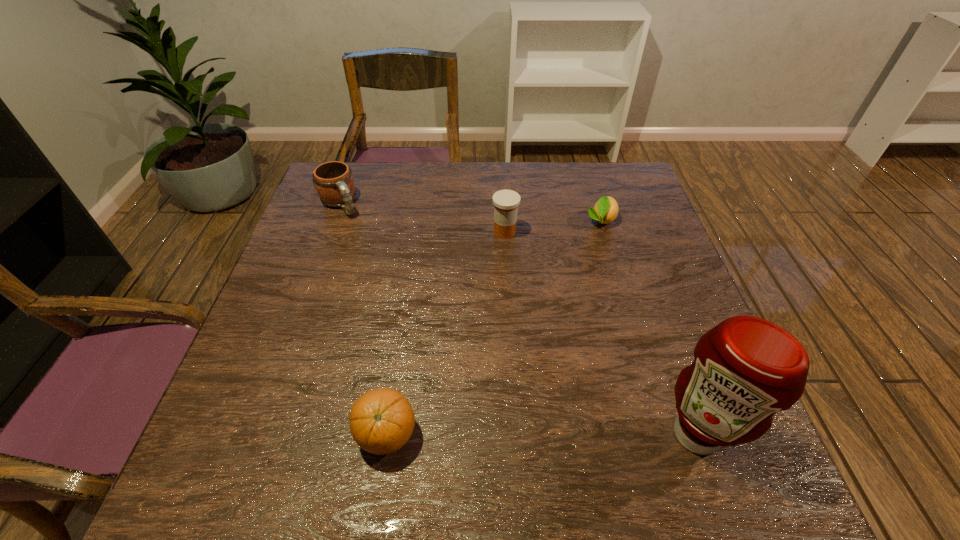
The height and width of the screenshot is (540, 960). Find the location of `vacant space on the desktop that is between the fourth object from right to left and the condiment and is positioned on the label of the third object from right to left`. vacant space on the desktop that is between the fourth object from right to left and the condiment and is positioned on the label of the third object from right to left is located at coordinates (532, 434).

In order to click on vacant space on the desktop that is between the orange and the condiment and is positioned on the side of the mug with the handle in this screenshot , I will do click(502, 434).

This screenshot has height=540, width=960. What are the coordinates of `free space on the desktop that is between the orange and the condiment and is positioned with leaves positioned above the lemon` in the screenshot? It's located at (535, 434).